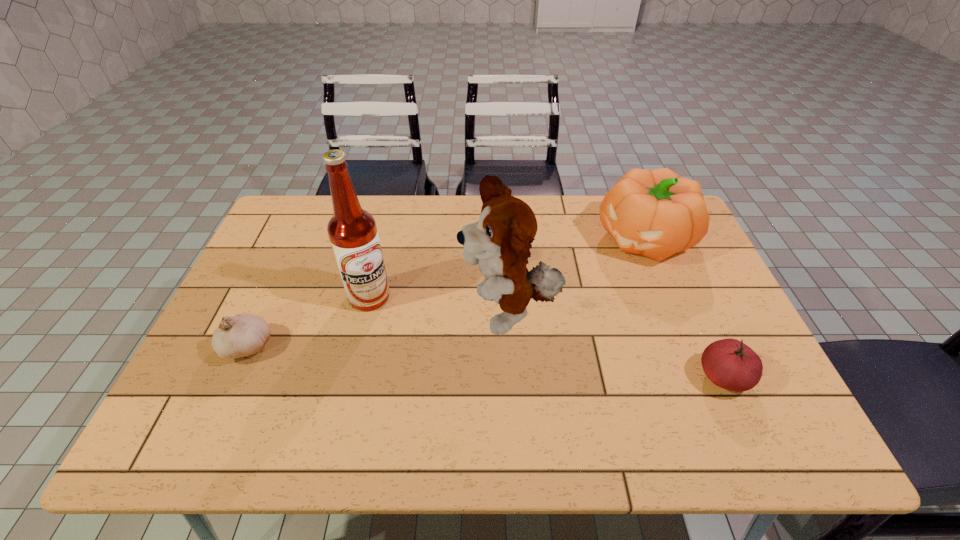
Where is `the leftmost object`? The width and height of the screenshot is (960, 540). the leftmost object is located at coordinates (244, 334).

Find the location of a particular element. tomato is located at coordinates (729, 363).

Locate an element on the screen. Image resolution: width=960 pixels, height=540 pixels. puppy is located at coordinates (500, 241).

The image size is (960, 540). Find the location of `the fourth shortest object`. the fourth shortest object is located at coordinates (500, 241).

The height and width of the screenshot is (540, 960). Identify the location of the third shortest object. (656, 213).

I want to click on pumpkin, so click(x=656, y=213).

Locate an element on the screen. The image size is (960, 540). alcohol is located at coordinates (352, 231).

Where is `free region located 0.050m on the front of the garlic`? free region located 0.050m on the front of the garlic is located at coordinates (228, 386).

The width and height of the screenshot is (960, 540). Identify the location of blank area located on the left of the tomato. (625, 377).

Locate an element on the screen. Image resolution: width=960 pixels, height=540 pixels. free spot located 0.110m on the face of the puppy is located at coordinates (426, 351).